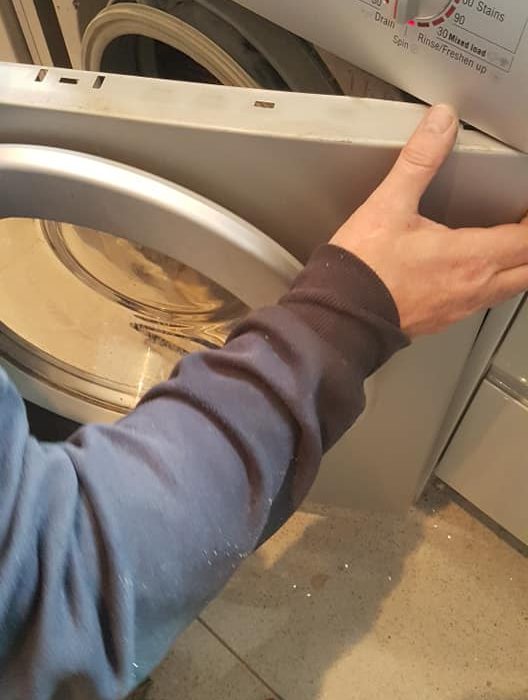
I want to click on knob, so click(x=403, y=5).